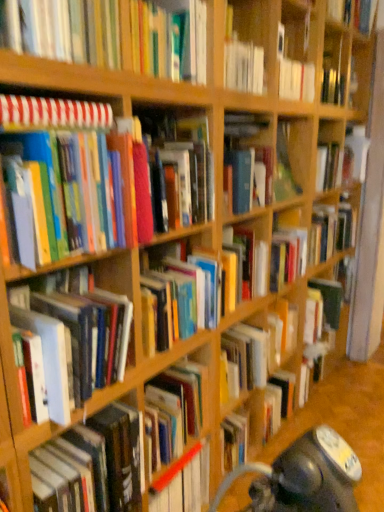
Question: Is hardcover book at center, the seventh book when ordered from top to bottom, a part of hardcover book at upper center, the 7th book positioned from the bottom?

Choices:
 (A) no
 (B) yes

Answer: (A)

Question: Does hardcover book at upper center, the 7th book positioned from the bottom, have a lesser width compared to hardcover book at center, the seventh book when ordered from top to bottom?

Choices:
 (A) yes
 (B) no

Answer: (B)

Question: Can you confirm if hardcover book at upper center, the 7th book positioned from the bottom, is shorter than hardcover book at center, the seventh book when ordered from top to bottom?

Choices:
 (A) yes
 (B) no

Answer: (B)

Question: Is hardcover book at upper center, arranged as the second book when viewed from the top, not within hardcover book at center, the seventh book when ordered from top to bottom?

Choices:
 (A) yes
 (B) no

Answer: (A)

Question: Can you confirm if hardcover book at upper center, arranged as the second book when viewed from the top, is positioned to the right of hardcover book at center, positioned as the second book in bottom-to-top order?

Choices:
 (A) yes
 (B) no

Answer: (B)

Question: Is point (266, 316) positioned closer to the camera than point (41, 106)?

Choices:
 (A) closer
 (B) farther

Answer: (B)

Question: Is hardcover book at center, the seventh book when ordered from top to bottom, in front of or behind striped paper notebook at upper left, the sixth book from the bottom, in the image?

Choices:
 (A) behind
 (B) front

Answer: (A)

Question: From a real-world perspective, relative to striped paper notebook at upper left, the sixth book from the bottom, is hardcover book at center, positioned as the second book in bottom-to-top order, vertically above or below?

Choices:
 (A) below
 (B) above

Answer: (A)

Question: Considering the positions of hardcover book at center, positioned as the second book in bottom-to-top order, and striped paper notebook at upper left, positioned as the 3th book in top-to-bottom order, in the image, is hardcover book at center, positioned as the second book in bottom-to-top order, wider or thinner than striped paper notebook at upper left, positioned as the 3th book in top-to-bottom order,?

Choices:
 (A) wide
 (B) thin

Answer: (B)

Question: In terms of height, does hardcover book at upper right, the eighth book ordered from the bottom, look taller or shorter compared to striped paper notebook at upper left, positioned as the 3th book in top-to-bottom order?

Choices:
 (A) tall
 (B) short

Answer: (A)

Question: Is hardcover book at upper right, arranged as the 1th book when viewed from the top, wider or thinner than striped paper notebook at upper left, positioned as the 3th book in top-to-bottom order?

Choices:
 (A) thin
 (B) wide

Answer: (A)

Question: Is hardcover book at upper right, the eighth book ordered from the bottom, inside the boundaries of striped paper notebook at upper left, positioned as the 3th book in top-to-bottom order, or outside?

Choices:
 (A) inside
 (B) outside

Answer: (B)

Question: In terms of size, does hardcover book at upper right, the eighth book ordered from the bottom, appear bigger or smaller than striped paper notebook at upper left, the sixth book from the bottom?

Choices:
 (A) big
 (B) small

Answer: (A)

Question: Considering the positions of point (6, 120) and point (165, 60), is point (6, 120) closer or farther from the camera than point (165, 60)?

Choices:
 (A) closer
 (B) farther

Answer: (A)

Question: Is striped paper notebook at upper left, positioned as the 3th book in top-to-bottom order, taller or shorter than hardcover book at upper center, the 7th book positioned from the bottom?

Choices:
 (A) short
 (B) tall

Answer: (A)